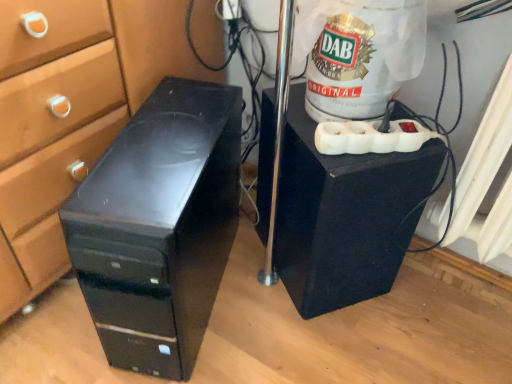
Question: Is black plastic computer tower at left, which ranks as the 2th furniture in right-to-left order, taller or shorter than black matte speaker at center, which is the 2th furniture in left-to-right order?

Choices:
 (A) short
 (B) tall

Answer: (B)

Question: Does point (136, 334) appear closer or farther from the camera than point (399, 203)?

Choices:
 (A) closer
 (B) farther

Answer: (A)

Question: From a real-world perspective, is black plastic computer tower at left, arranged as the first furniture when viewed from the left, above or below black matte speaker at center, which is the 2th furniture in left-to-right order?

Choices:
 (A) above
 (B) below

Answer: (A)

Question: From the image's perspective, is black matte speaker at center, which is the 2th furniture in left-to-right order, positioned above or below black plastic computer tower at left, arranged as the first furniture when viewed from the left?

Choices:
 (A) below
 (B) above

Answer: (B)

Question: Is black matte speaker at center, which is the 2th furniture in left-to-right order, bigger or smaller than black plastic computer tower at left, arranged as the first furniture when viewed from the left?

Choices:
 (A) big
 (B) small

Answer: (B)

Question: From a real-world perspective, is black matte speaker at center, which is the 2th furniture in left-to-right order, physically located above or below black plastic computer tower at left, which ranks as the 2th furniture in right-to-left order?

Choices:
 (A) above
 (B) below

Answer: (B)

Question: Is black matte speaker at center, which is the 2th furniture in left-to-right order, taller or shorter than black plastic computer tower at left, which ranks as the 2th furniture in right-to-left order?

Choices:
 (A) short
 (B) tall

Answer: (A)